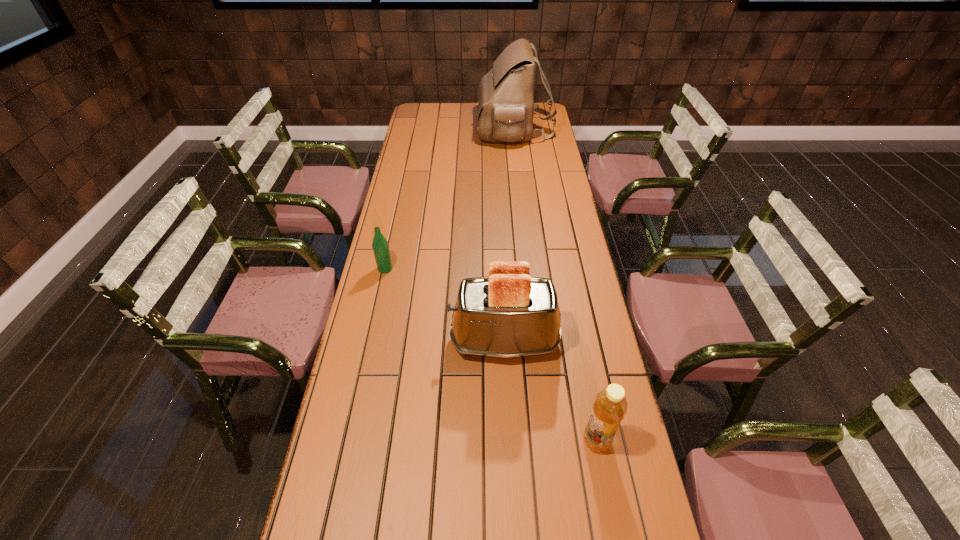
Where is `free spot between the nearest object and the third shortest object`? The width and height of the screenshot is (960, 540). free spot between the nearest object and the third shortest object is located at coordinates (550, 391).

Where is `vacant area that lies between the farthest object and the shortest object`? vacant area that lies between the farthest object and the shortest object is located at coordinates (449, 199).

The width and height of the screenshot is (960, 540). I want to click on unoccupied position between the farther bottle and the second nearest object, so click(x=444, y=305).

Find the location of a particular element. This screenshot has height=540, width=960. object that is the second closest to the farther bottle is located at coordinates (610, 405).

The image size is (960, 540). Identify the location of the second closest object to the left bottle. (610, 405).

Identify the location of vacant space that satisfies the following two spatial constraints: 1. on the front side of the shorter bottle; 2. on the left side of the nearest object. This screenshot has width=960, height=540. (348, 441).

Locate an element on the screen. The image size is (960, 540). vacant area that satisfies the following two spatial constraints: 1. on the side of the toaster with the control lever; 2. on the right side of the nearer bottle is located at coordinates (509, 441).

The height and width of the screenshot is (540, 960). Find the location of `vacant area that satisfies the following two spatial constraints: 1. on the side of the second nearest object with the control lever; 2. on the back side of the nearest object`. vacant area that satisfies the following two spatial constraints: 1. on the side of the second nearest object with the control lever; 2. on the back side of the nearest object is located at coordinates (509, 441).

Find the location of a particular element. vacant space that satisfies the following two spatial constraints: 1. on the front flap of the farthest object; 2. on the back side of the third tallest object is located at coordinates (550, 441).

Locate an element on the screen. The height and width of the screenshot is (540, 960). vacant position in the image that satisfies the following two spatial constraints: 1. on the side of the second tallest object with the control lever; 2. on the right side of the taller bottle is located at coordinates (509, 441).